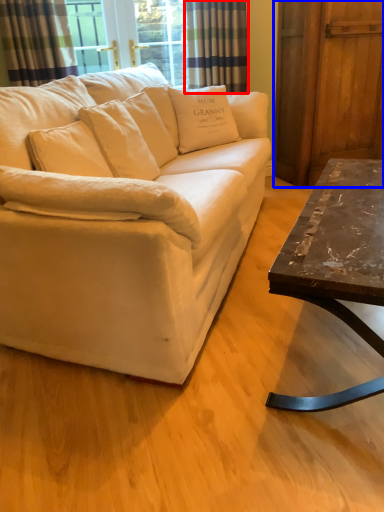
Question: Which object is further to the camera taking this photo, curtain (highlighted by a red box) or barn door (highlighted by a blue box)?

Choices:
 (A) curtain
 (B) barn door

Answer: (A)